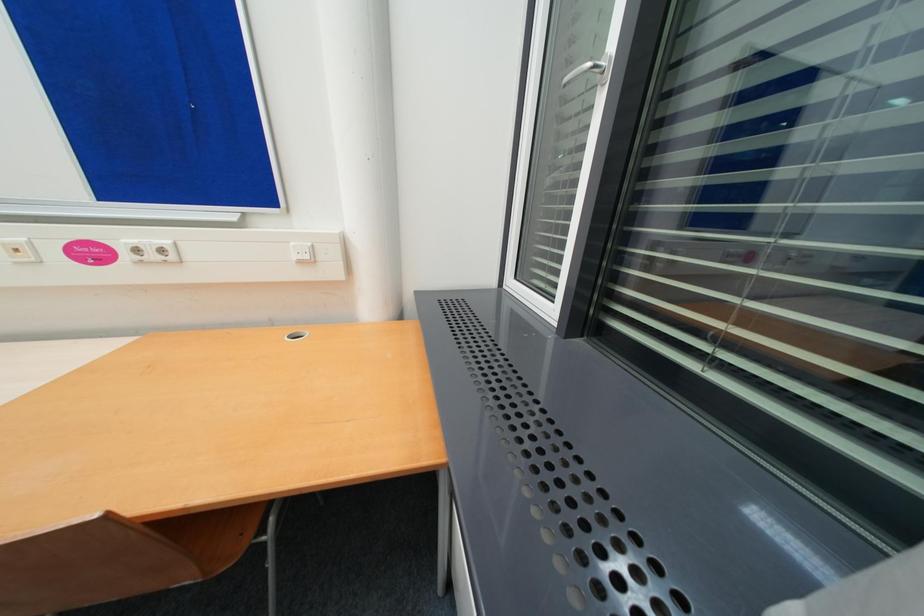
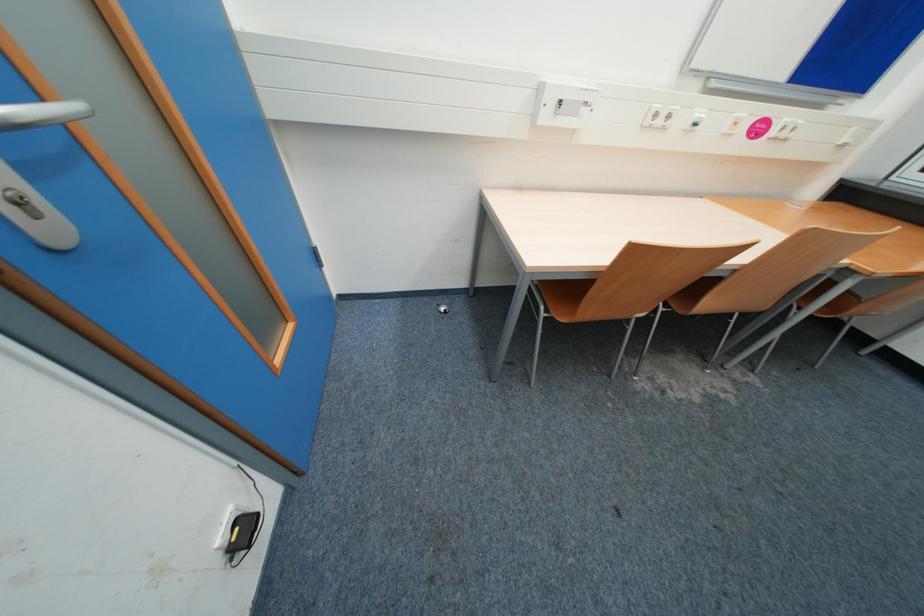
Question: Which direction would the cameraman need to move to produce the second image? Reply with the corresponding letter.

Choices:
 (A) Left
 (B) Right
 (C) Forward
 (D) Backward

Answer: (A)